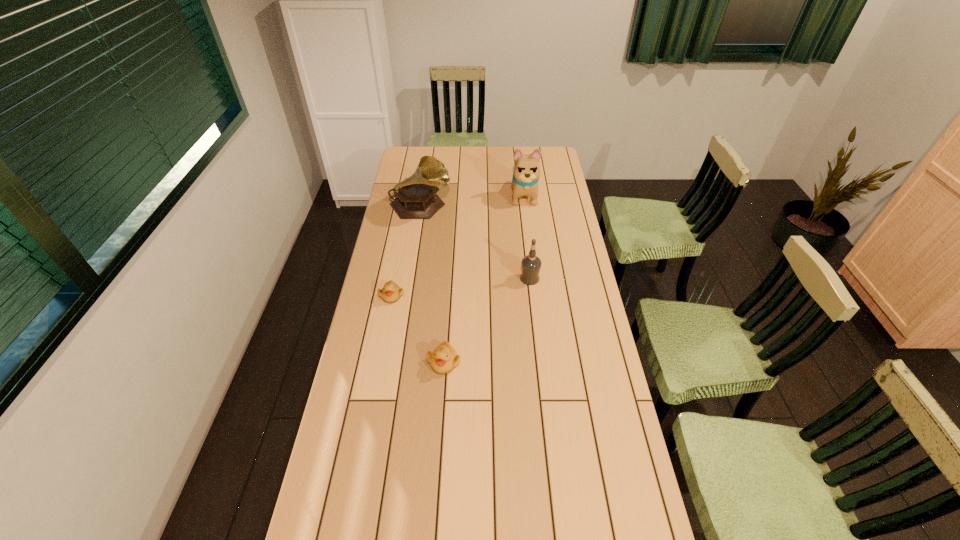
In the image, there is a desktop. Identify the location of vacant space at the right edge. (618, 408).

I want to click on vacant space at the far left corner of the desktop, so click(417, 147).

Image resolution: width=960 pixels, height=540 pixels. What are the coordinates of `vacant region at the far right corner` in the screenshot? It's located at (547, 158).

I want to click on vacant area that lies between the third shortest object and the phonograph record, so click(x=475, y=243).

This screenshot has width=960, height=540. I want to click on unoccupied area between the puppy and the third shortest object, so click(x=527, y=237).

Find the location of `empty location between the phonograph record and the vodka`. empty location between the phonograph record and the vodka is located at coordinates (475, 243).

The height and width of the screenshot is (540, 960). In order to click on free space between the farther duckling and the nearest object in this screenshot , I will do `click(418, 329)`.

The width and height of the screenshot is (960, 540). Find the location of `free space that is in between the nearest object and the third farthest object`. free space that is in between the nearest object and the third farthest object is located at coordinates (487, 320).

Find the location of a particular element. This screenshot has width=960, height=540. free space between the puppy and the phonograph record is located at coordinates (472, 201).

I want to click on vacant region between the third tallest object and the phonograph record, so click(x=475, y=243).